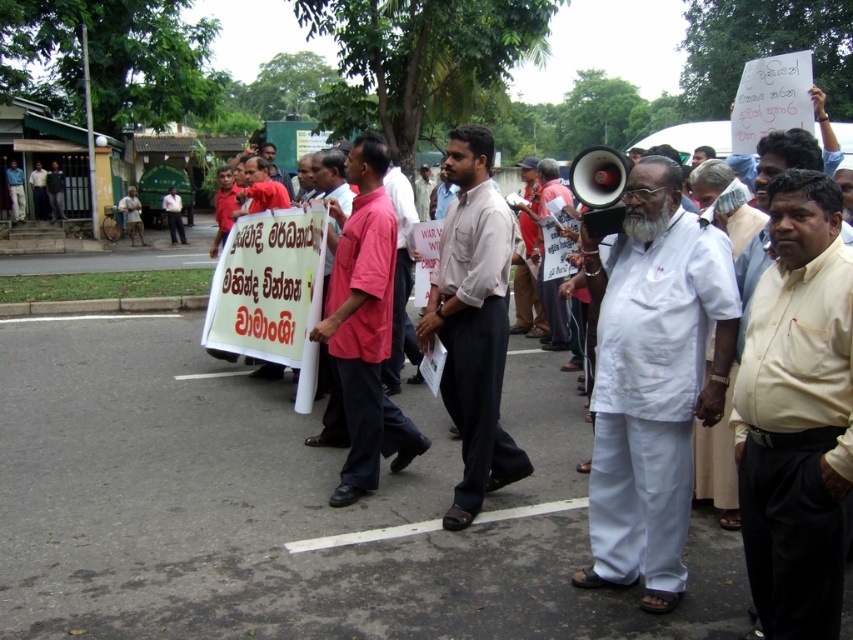
Question: Estimate the real-world distances between objects in this image. Which object is farther from the light beige shirt at center?

Choices:
 (A) red shirt at center
 (B) white cloth megaphone at center

Answer: (A)

Question: Is beige cotton shirt at right in front of white cloth megaphone at center?

Choices:
 (A) yes
 (B) no

Answer: (A)

Question: Is white fabric shirt at center wider than red shirt at center?

Choices:
 (A) yes
 (B) no

Answer: (B)

Question: Which object appears closest to the camera in this image?

Choices:
 (A) light beige shirt at center
 (B) white cotton shirt at center

Answer: (B)

Question: Among these points, which one is farthest from the camera?

Choices:
 (A) (631, 522)
 (B) (534, 273)
 (C) (338, 243)

Answer: (B)

Question: Is the position of white cotton shirt at center less distant than that of beige cotton shirt at right?

Choices:
 (A) no
 (B) yes

Answer: (A)